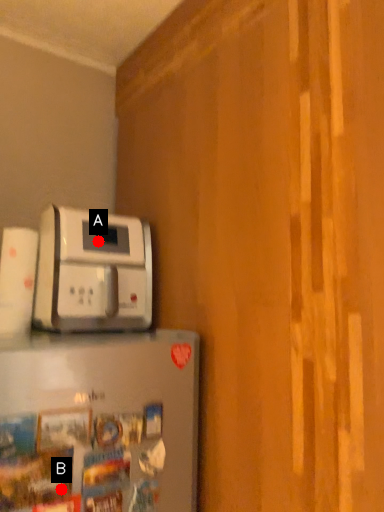
Question: Two points are circled on the image, labeled by A and B beside each circle. Which point is closer to the camera?

Choices:
 (A) A is closer
 (B) B is closer

Answer: (B)